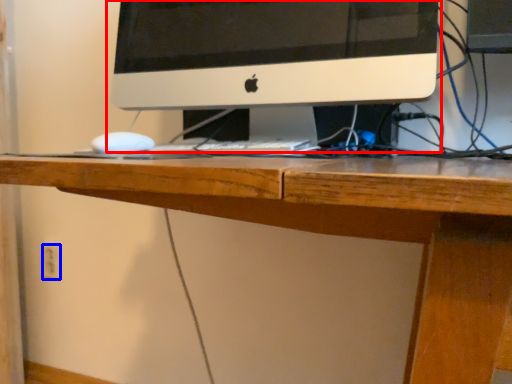
Question: Which point is closer to the camera, computer monitor (highlighted by a red box) or electric outlet (highlighted by a blue box)?

Choices:
 (A) computer monitor
 (B) electric outlet

Answer: (A)